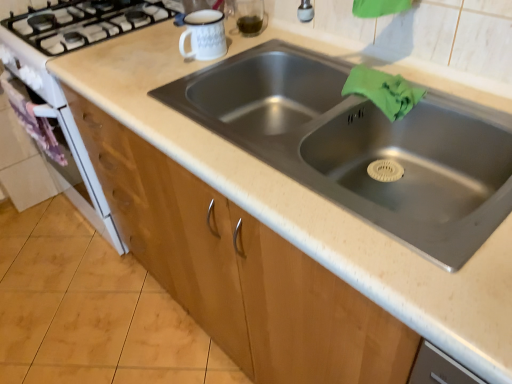
Question: Is wooden cabinet at lower center oriented towards stainless steel sink at center?

Choices:
 (A) no
 (B) yes

Answer: (A)

Question: From a real-world perspective, is wooden cabinet at lower center on top of stainless steel sink at center?

Choices:
 (A) no
 (B) yes

Answer: (A)

Question: Is wooden cabinet at lower center bigger than stainless steel sink at center?

Choices:
 (A) no
 (B) yes

Answer: (A)

Question: Are wooden cabinet at lower center and stainless steel sink at center making contact?

Choices:
 (A) no
 (B) yes

Answer: (A)

Question: From the image's perspective, is wooden cabinet at lower center above stainless steel sink at center?

Choices:
 (A) no
 (B) yes

Answer: (A)

Question: From a real-world perspective, is green fabric at sink right physically located above or below wooden cabinet at lower center?

Choices:
 (A) below
 (B) above

Answer: (B)

Question: Is green fabric at sink right inside the boundaries of wooden cabinet at lower center, or outside?

Choices:
 (A) outside
 (B) inside

Answer: (A)

Question: Does point (395, 82) appear closer or farther from the camera than point (380, 332)?

Choices:
 (A) closer
 (B) farther

Answer: (B)

Question: Based on their positions, is green fabric at sink right located to the left or right of wooden cabinet at lower center?

Choices:
 (A) left
 (B) right

Answer: (B)

Question: From the image's perspective, is stainless steel sink at center positioned above or below green fabric at sink right?

Choices:
 (A) above
 (B) below

Answer: (B)

Question: Considering the positions of point (365, 130) and point (388, 86), is point (365, 130) closer or farther from the camera than point (388, 86)?

Choices:
 (A) farther
 (B) closer

Answer: (A)

Question: Choose the correct answer: Is stainless steel sink at center inside green fabric at sink right or outside it?

Choices:
 (A) inside
 (B) outside

Answer: (B)

Question: Based on their positions, is stainless steel sink at center located to the left or right of green fabric at sink right?

Choices:
 (A) right
 (B) left

Answer: (B)

Question: In terms of height, does green fabric at sink right look taller or shorter compared to stainless steel sink at center?

Choices:
 (A) short
 (B) tall

Answer: (A)

Question: Looking at their shapes, would you say green fabric at sink right is wider or thinner than stainless steel sink at center?

Choices:
 (A) wide
 (B) thin

Answer: (B)